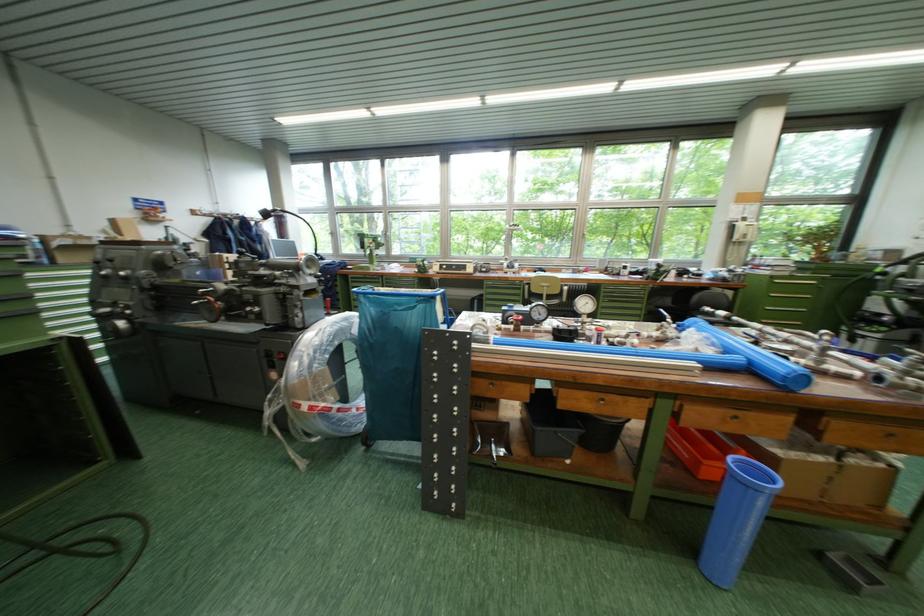
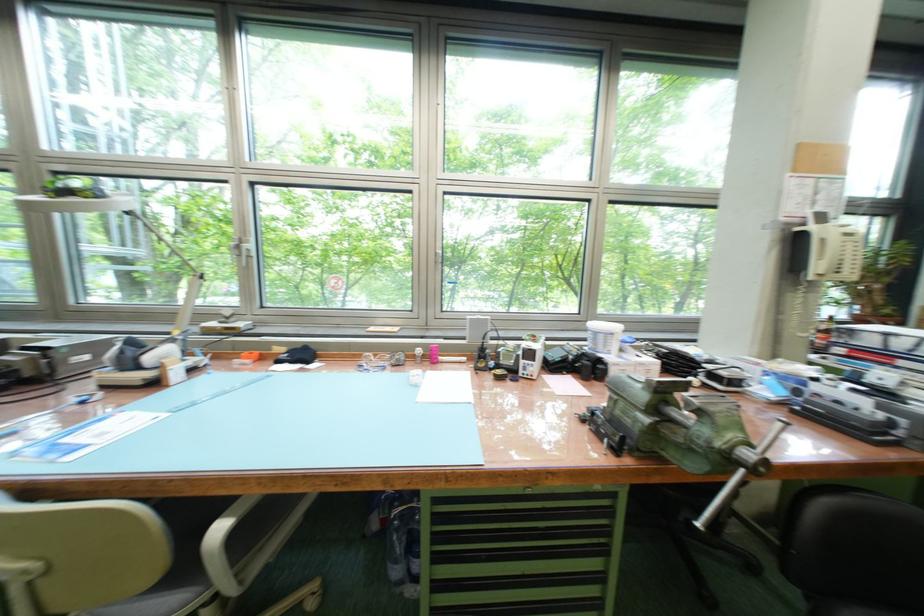
Which direction would the cameraman need to move to produce the second image?

The movement direction of the cameraman is right, forward.